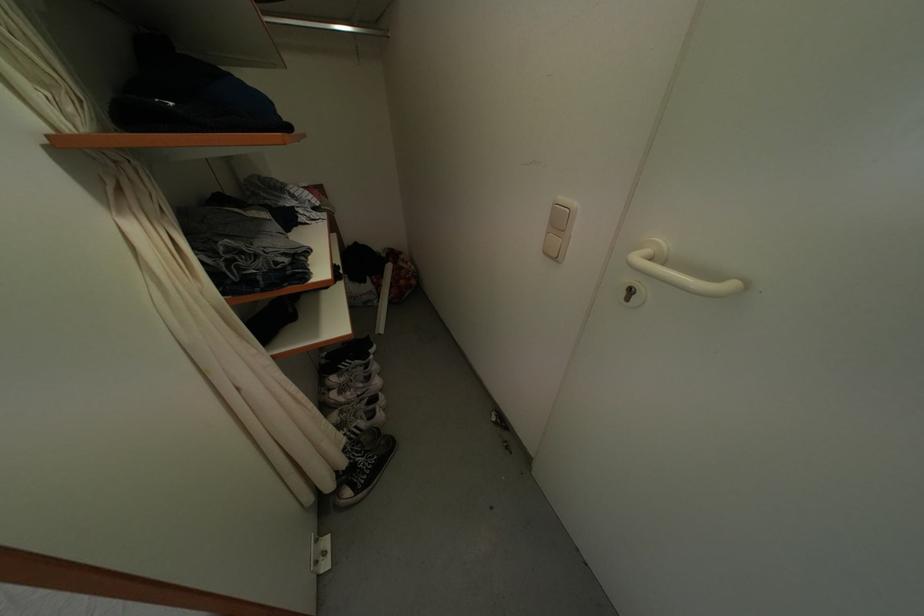
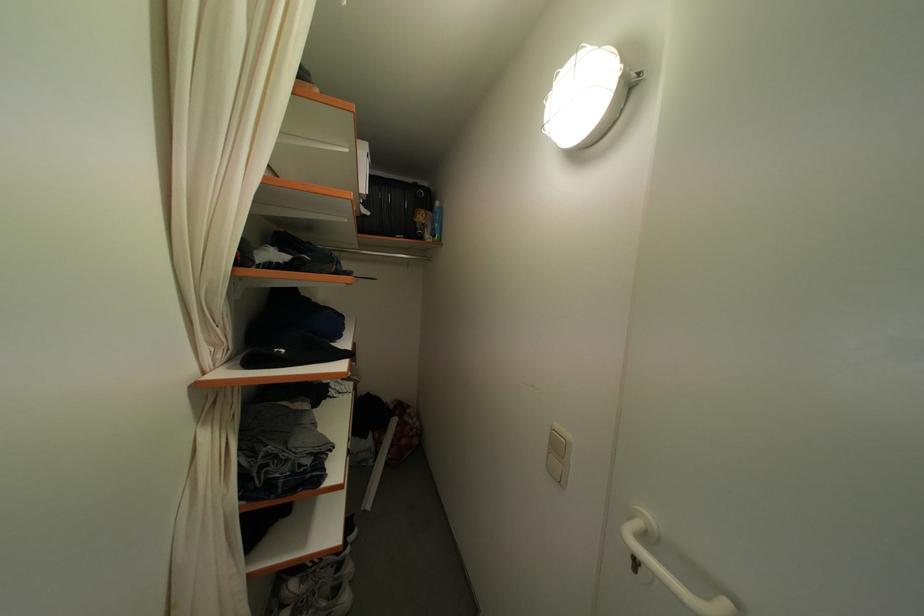
Question: How did the camera likely rotate?

Choices:
 (A) Left
 (B) Right
 (C) Up
 (D) Down

Answer: (C)